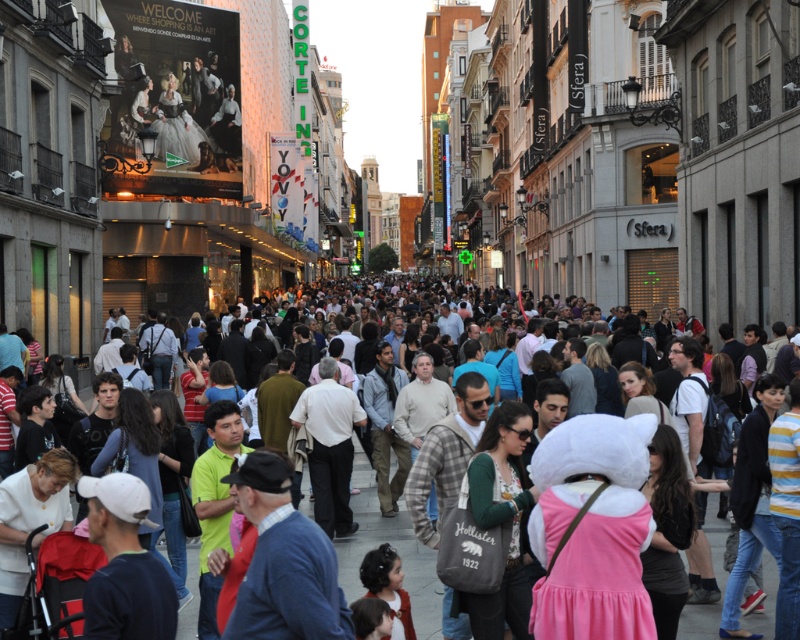
Does striped knit sweater at lower right have a greater height compared to dark hair at center?

Correct, striped knit sweater at lower right is much taller as dark hair at center.

This screenshot has height=640, width=800. Identify the location of striped knit sweater at lower right. (x=752, y=502).

Which is in front, point (738, 611) or point (182, 605)?

Positioned in front is point (738, 611).

Locate an element on the screen. The width and height of the screenshot is (800, 640). striped knit sweater at lower right is located at coordinates (752, 502).

Does multicolored casual attire at center have a larger size compared to light blue shirt at center?

Correct, multicolored casual attire at center is larger in size than light blue shirt at center.

Does multicolored casual attire at center appear under light blue shirt at center?

No.

Where is `multicolored casual attire at center`? multicolored casual attire at center is located at coordinates point(392,544).

What are the coordinates of `multicolored casual attire at center` in the screenshot? It's located at (392, 544).

Which is below, multicolored casual attire at center or pink fabric costume at center?

pink fabric costume at center is below.

In order to click on multicolored casual attire at center in this screenshot , I will do `click(392, 544)`.

What are the coordinates of `multicolored casual attire at center` in the screenshot? It's located at (392, 544).